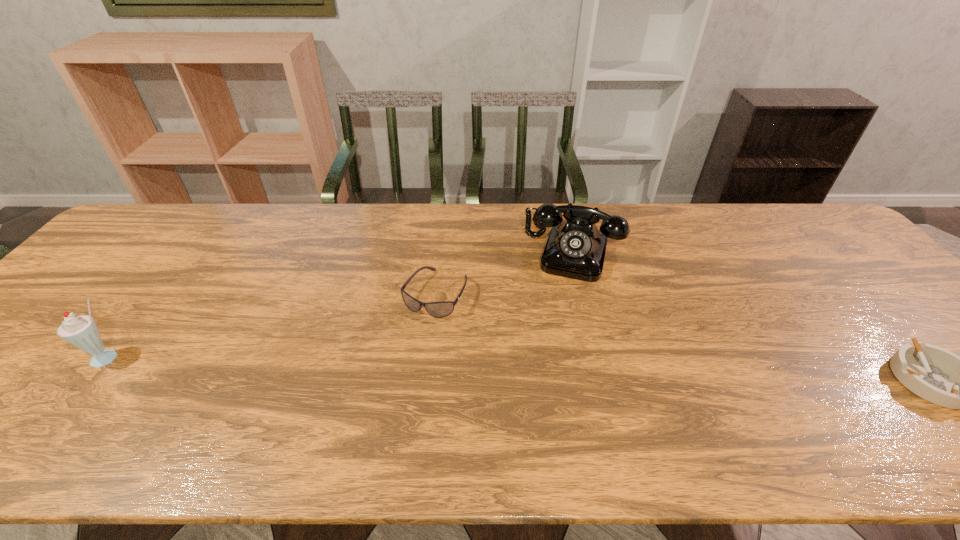
At what (x,y) coordinates should I click in order to perform the action: click on free space at the near right corner of the desktop. Please return your answer as a coordinate pair (x, y). Looking at the image, I should click on (938, 410).

Where is `free point between the leftmost object and the telephone`? The image size is (960, 540). free point between the leftmost object and the telephone is located at coordinates (341, 304).

Locate an element on the screen. The image size is (960, 540). free area in between the second object from right to left and the tallest object is located at coordinates (341, 304).

Identify the location of vacant area that lies between the second object from left to right and the second object from right to left. (505, 272).

Find the location of a particular element. This screenshot has width=960, height=540. free space between the tallest object and the sunglasses is located at coordinates (272, 326).

This screenshot has height=540, width=960. I want to click on unoccupied area between the second tallest object and the sunglasses, so click(x=505, y=272).

You are a GUI agent. You are given a task and a screenshot of the screen. Output one action in this format:
    pyautogui.click(x=<x>, y=<y>)
    Task: Click on the object that stands as the closest to the second object from left to right
    
    Given the screenshot: What is the action you would take?
    pyautogui.click(x=575, y=248)

This screenshot has height=540, width=960. I want to click on the third closest object to the telephone, so click(81, 331).

Where is `blank space that satisfies the following two spatial constraints: 1. on the back side of the second tallest object; 2. on the right side of the second object from left to right`? blank space that satisfies the following two spatial constraints: 1. on the back side of the second tallest object; 2. on the right side of the second object from left to right is located at coordinates (441, 250).